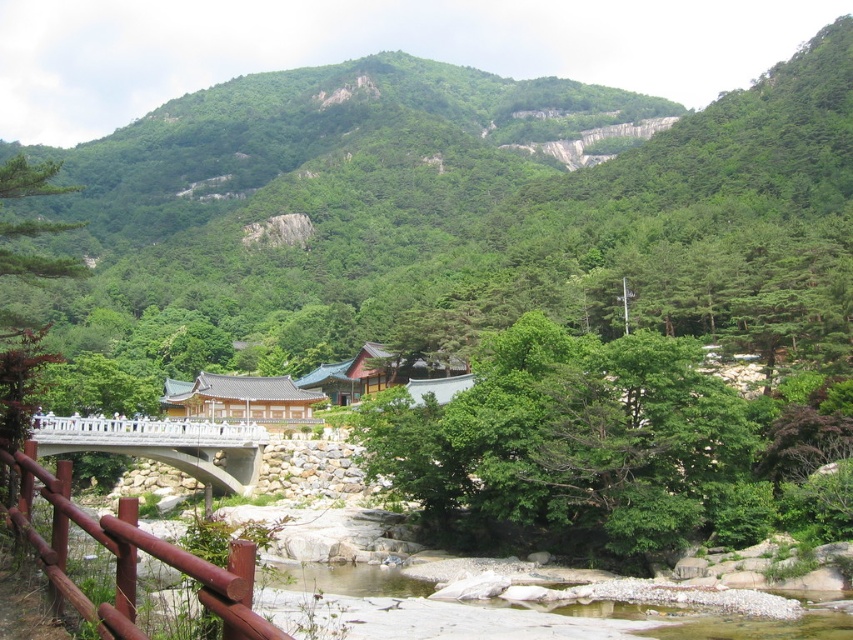
Question: Can you confirm if brown wooden rail at lower left is smaller than white concrete bridge at center?

Choices:
 (A) yes
 (B) no

Answer: (A)

Question: Among these objects, which one is nearest to the camera?

Choices:
 (A) white concrete bridge at center
 (B) brown wooden rail at lower left

Answer: (B)

Question: Does brown wooden rail at lower left lie in front of white concrete bridge at center?

Choices:
 (A) no
 (B) yes

Answer: (B)

Question: Among these points, which one is nearest to the camera?

Choices:
 (A) (74, 515)
 (B) (206, 468)

Answer: (A)

Question: Does brown wooden rail at lower left have a lesser width compared to white concrete bridge at center?

Choices:
 (A) no
 (B) yes

Answer: (B)